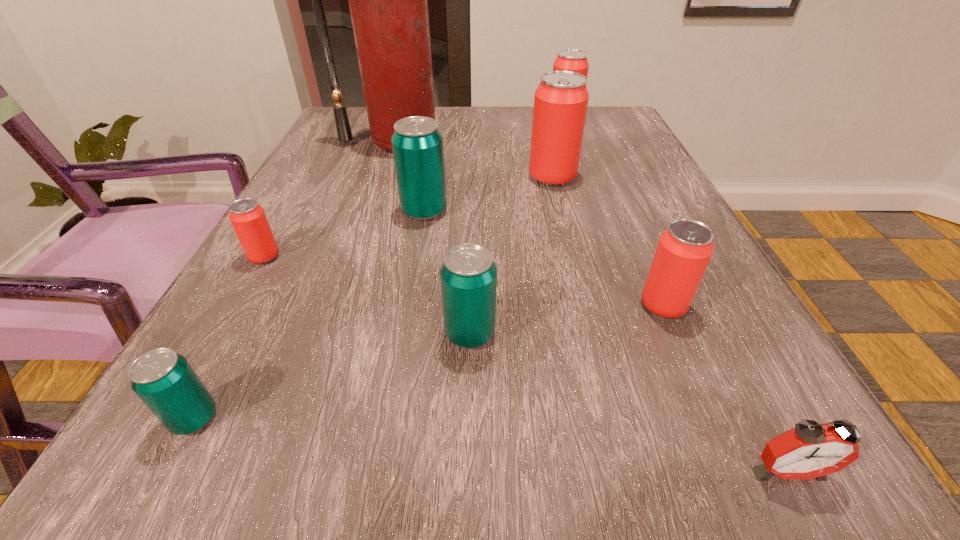
Identify which beer can is the fifth nearest to the farthest red beer can. Please provide its 2D coordinates. Your answer should be formatted as a tuple, i.e. [(x, y)], where the tuple contains the x and y coordinates of a point satisfying the conditions above.

[(247, 217)]

Identify which beer can is the sixth closest to the third smallest red beer can. Please provide its 2D coordinates. Your answer should be formatted as a tuple, i.e. [(x, y)], where the tuple contains the x and y coordinates of a point satisfying the conditions above.

[(164, 380)]

Identify which red beer can is the second closest to the second smallest red beer can. Please provide its 2D coordinates. Your answer should be formatted as a tuple, i.e. [(x, y)], where the tuple contains the x and y coordinates of a point satisfying the conditions above.

[(247, 217)]

Identify the location of red beer can that is the second closest to the farthest beer can. (684, 250).

Identify which teal beer can is the second nearest to the red fire extinguisher. Please provide its 2D coordinates. Your answer should be formatted as a tuple, i.e. [(x, y)], where the tuple contains the x and y coordinates of a point satisfying the conditions above.

[(468, 274)]

Where is `teal beer can that is the third closest to the smallest red beer can`? The height and width of the screenshot is (540, 960). teal beer can that is the third closest to the smallest red beer can is located at coordinates (468, 274).

Where is `vacant region that satisfies the following two spatial constraints: 1. on the back side of the farthest teal beer can; 2. on the left side of the fifth nearest object`? vacant region that satisfies the following two spatial constraints: 1. on the back side of the farthest teal beer can; 2. on the left side of the fifth nearest object is located at coordinates (290, 211).

Identify the location of free space that satisfies the following two spatial constraints: 1. on the back side of the farthest teal beer can; 2. on the right side of the third nearest red beer can. Image resolution: width=960 pixels, height=540 pixels. (430, 177).